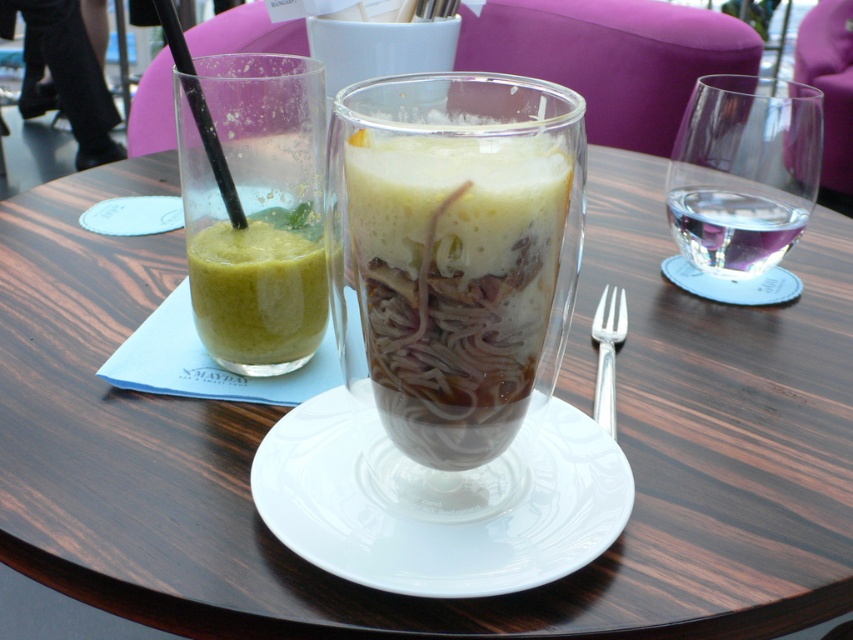
Does transparent plastic straw at upper center have a lesser height compared to silver metallic fork at center right?

No.

At what (x,y) coordinates should I click in order to perform the action: click on transparent plastic straw at upper center. Please return your answer as a coordinate pair (x, y). This screenshot has height=640, width=853. Looking at the image, I should click on (199, 109).

Is point (180, 54) positioned before point (618, 314)?

Yes, it is in front of point (618, 314).

Locate an element on the screen. Image resolution: width=853 pixels, height=640 pixels. transparent plastic straw at upper center is located at coordinates (199, 109).

Measure the distance between white ceramic plate at center and camera.

white ceramic plate at center is 9.14 inches away from camera.

Between point (538, 529) and point (735, 228), which one is positioned behind?

The point (735, 228) is behind.

Is point (376, 561) in front of point (747, 241)?

Yes, point (376, 561) is in front of point (747, 241).

Image resolution: width=853 pixels, height=640 pixels. Identify the location of white ceramic plate at center. (440, 524).

Is translucent glass cup at center closer to the viewer compared to white ceramic plate at center?

Yes, it is.

Is translucent glass cup at center taller than white ceramic plate at center?

Correct, translucent glass cup at center is much taller as white ceramic plate at center.

Is point (347, 241) positioned behind point (267, 524)?

No, it is not.

Identify the location of translucent glass cup at center. This screenshot has width=853, height=640. (453, 282).